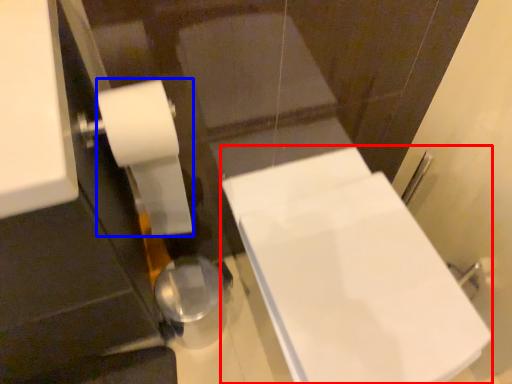
Question: Among these objects, which one is nearest to the camera, bath (highlighted by a red box) or toilet paper (highlighted by a blue box)?

Choices:
 (A) bath
 (B) toilet paper

Answer: (B)